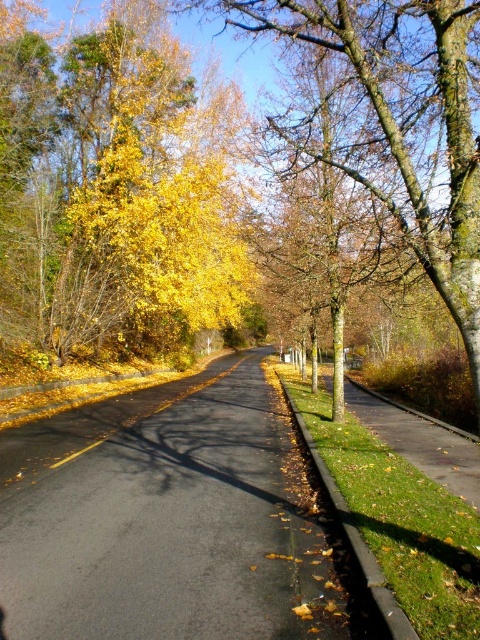
Question: Is yellow leafy tree at left thinner than yellow leafy tree at center?

Choices:
 (A) no
 (B) yes

Answer: (A)

Question: Among these objects, which one is nearest to the camera?

Choices:
 (A) yellow leafy tree at center
 (B) yellow leafy tree at left

Answer: (A)

Question: Is yellow leafy tree at left wider than yellow leafy tree at center?

Choices:
 (A) yes
 (B) no

Answer: (A)

Question: Which object appears closest to the camera in this image?

Choices:
 (A) yellow leafy tree at left
 (B) yellow leafy tree at center

Answer: (B)

Question: Which of the following is the closest to the observer?

Choices:
 (A) yellow leafy tree at center
 (B) yellow leafy tree at left

Answer: (A)

Question: Does yellow leafy tree at left have a smaller size compared to yellow leafy tree at center?

Choices:
 (A) no
 (B) yes

Answer: (B)